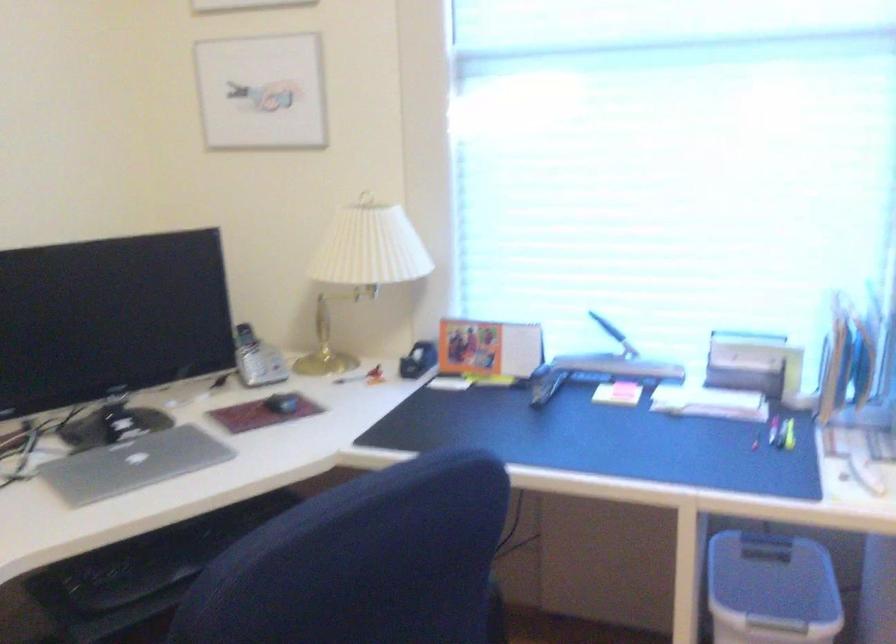
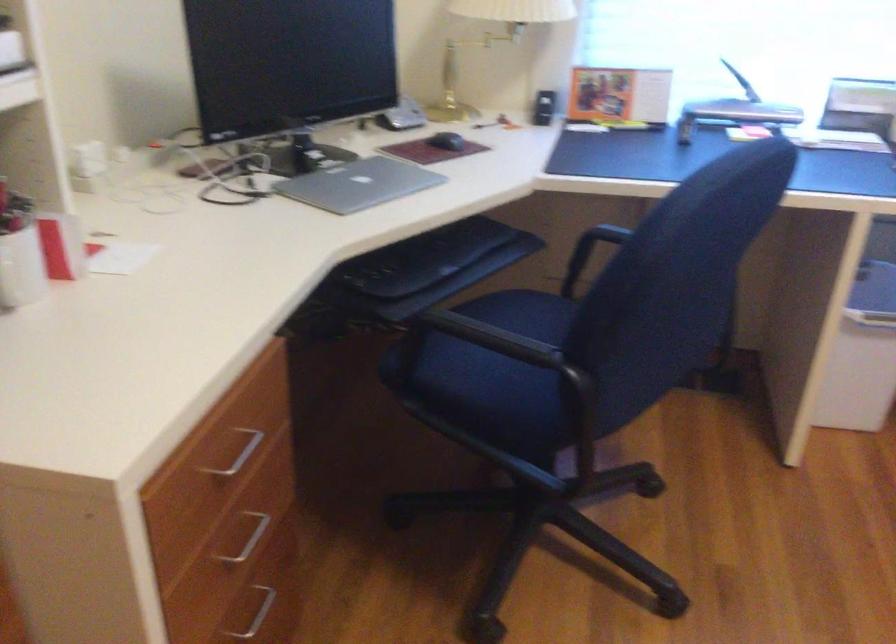
The point at (177, 553) is marked in the first image. Where is the corresponding point in the second image?

(425, 258)